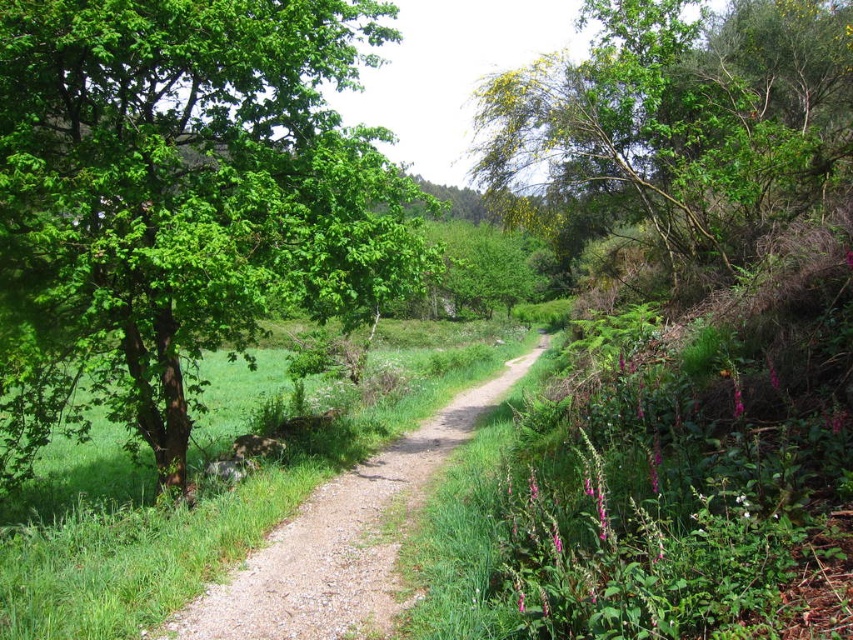
You are a hiker walking along the dirt path at center and want to take a photo of the green leafy tree at upper right. Considering their sizes, will the tree fit entirely in your camera frame if you stand where you are?

The green leafy tree at upper right is wider than the dirt path at center, so if you are standing on the dirt path at center, the tree might not fit entirely in your camera frame because its width is greater than the path.

You are standing at the starting point of the rural path and want to reach a destination located at point (648,3). There is an obstacle at point (386,17) which is closer to you. Can you go around it by moving to the right side of the path?

Point (386,17) is closer to you than point (648,3). To go around the obstacle, you can move to the right side of the path since the obstacle is on the left side of the path.

You are standing at the starting point of the rural path and see the point marked at coordinates (178, 196). What does this point indicate?

The point at coordinates (178, 196) marks the location of the green leafy tree at left.